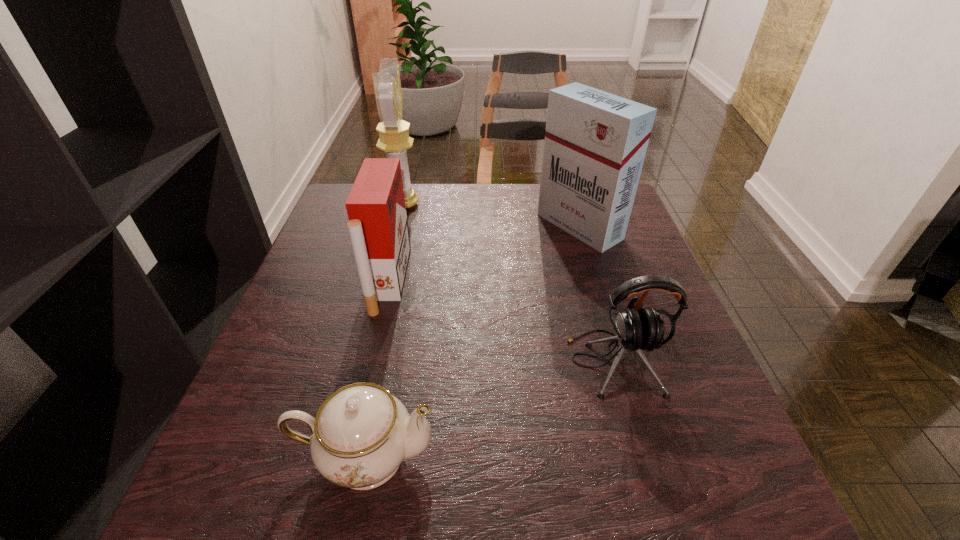
The image size is (960, 540). In order to click on vacant region between the shorter cigarette case and the second nearest object in this screenshot , I will do `click(501, 321)`.

The image size is (960, 540). I want to click on vacant space in between the second nearest object and the shorter cigarette case, so click(x=501, y=321).

This screenshot has width=960, height=540. In order to click on free space between the taller cigarette case and the shorter cigarette case in this screenshot , I will do `click(484, 253)`.

The width and height of the screenshot is (960, 540). Find the location of `free space between the shorter cigarette case and the earphone`. free space between the shorter cigarette case and the earphone is located at coordinates (501, 321).

The image size is (960, 540). In order to click on free space that is in between the earphone and the taller cigarette case in this screenshot , I will do `click(596, 294)`.

Identify the location of empty space that is in between the fourth farthest object and the left cigarette case. (501, 321).

Identify the location of free space between the right cigarette case and the earphone. (596, 294).

This screenshot has height=540, width=960. Identify the location of object that is the closest one to the nearest object. (378, 228).

Select which object appears as the second closest to the award. Please provide its 2D coordinates. Your answer should be formatted as a tuple, i.e. [(x, y)], where the tuple contains the x and y coordinates of a point satisfying the conditions above.

[(595, 144)]

At what (x,y) coordinates should I click in order to perform the action: click on vacant area that satisfies the following two spatial constraints: 1. on the front-facing side of the second nearest object; 2. on the right side of the award. Please return your answer as a coordinate pair (x, y). Image resolution: width=960 pixels, height=540 pixels. Looking at the image, I should click on (364, 362).